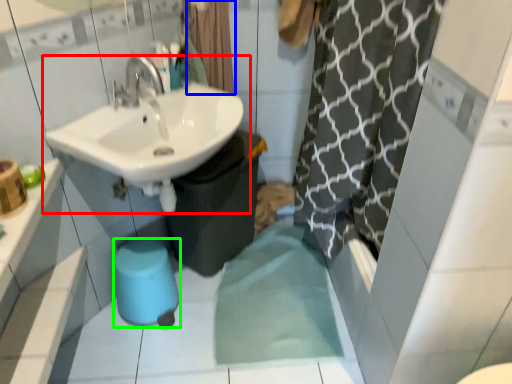
Question: Considering the real-world distances, which object is closest to sink (highlighted by a red box)? shower curtain (highlighted by a blue box) or bidet (highlighted by a green box).

Choices:
 (A) shower curtain
 (B) bidet

Answer: (A)